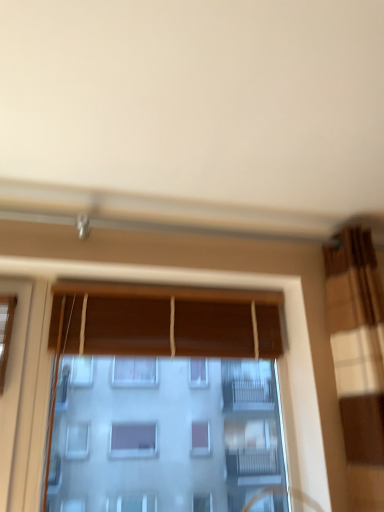
Question: Looking at their shapes, would you say wooden blinds at center, the second curtain positioned from the right, is wider or thinner than brown textured curtain at right, arranged as the 2th curtain when viewed from the left?

Choices:
 (A) wide
 (B) thin

Answer: (B)

Question: Considering the relative positions of wooden blinds at center, the second curtain positioned from the right, and brown textured curtain at right, arranged as the 2th curtain when viewed from the left, in the image provided, is wooden blinds at center, the second curtain positioned from the right, to the left or to the right of brown textured curtain at right, arranged as the 2th curtain when viewed from the left,?

Choices:
 (A) right
 (B) left

Answer: (B)

Question: Estimate the real-world distances between objects in this image. Which object is closer to the wooden blinds at center, the second curtain positioned from the right?

Choices:
 (A) brown textured curtain at right, arranged as the 2th curtain when viewed from the left
 (B) wooden blinds at center

Answer: (B)

Question: Estimate the real-world distances between objects in this image. Which object is farther from the wooden blinds at center?

Choices:
 (A) brown textured curtain at right, the 1th curtain viewed from the right
 (B) wooden blinds at center, placed as the first curtain when sorted from left to right

Answer: (A)